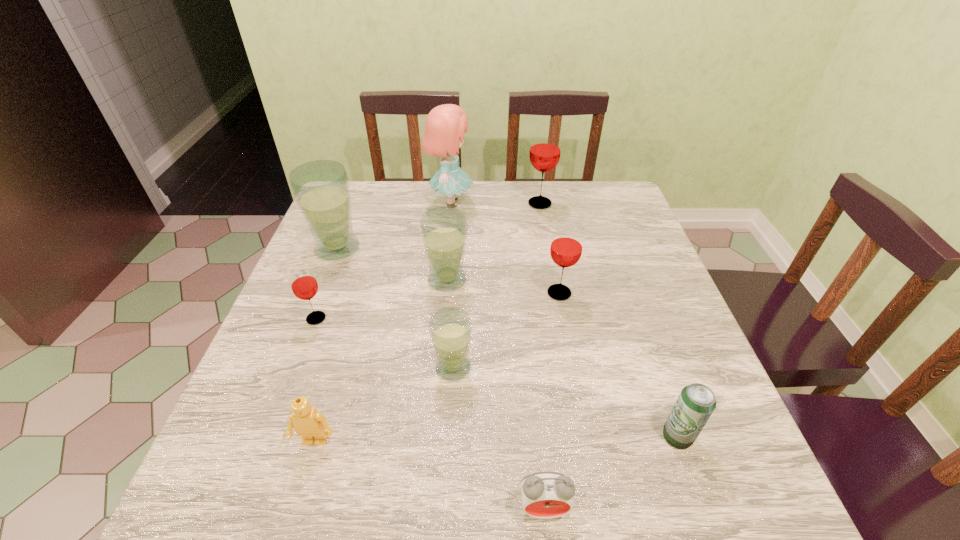
Find the location of a particular element. Image resolution: width=960 pixels, height=540 pixels. blue glass that is the third closest one to the farthest glass is located at coordinates (450, 329).

Select which blue glass appears as the second closest to the second biggest red glass. Please provide its 2D coordinates. Your answer should be formatted as a tuple, i.e. [(x, y)], where the tuple contains the x and y coordinates of a point satisfying the conditions above.

[(450, 329)]

Locate an element on the screen. Image resolution: width=960 pixels, height=540 pixels. free location that satisfies the following two spatial constraints: 1. on the front-facing side of the blue doll; 2. on the face of the Lego is located at coordinates (429, 442).

Identify the location of free location that satisfies the following two spatial constraints: 1. on the back side of the farthest glass; 2. on the front-facing side of the tallest object. (540, 202).